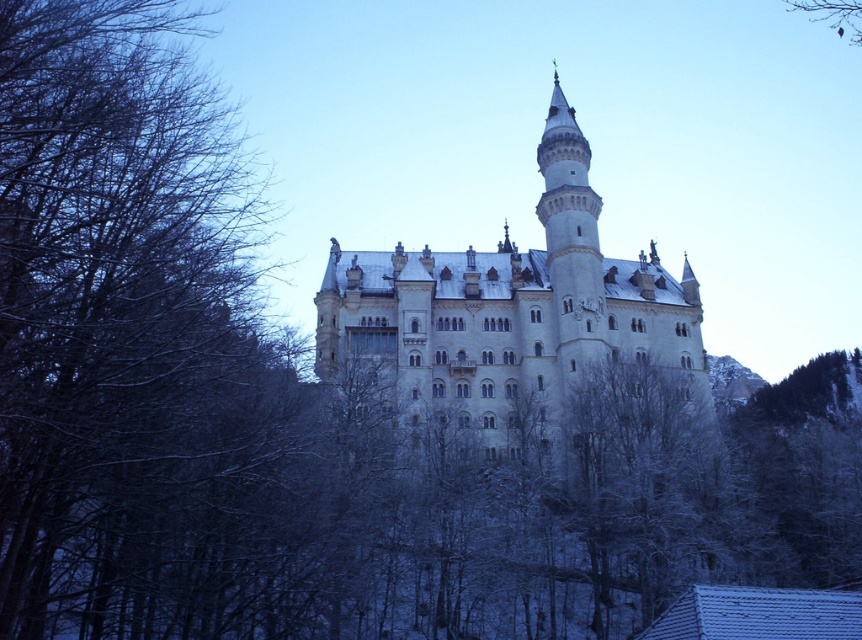
You are a bird flying over a winter landscape. You spot the white stone castle at center and the brown textured branch at upper right. How far apart are these two landmarks?

The white stone castle at center is 200.27 feet from the brown textured branch at upper right.

You are an architect examining the castle layout. From your vantage point, does the white stone castle at center appear positioned above or below the brown textured branch at upper right?

The white stone castle at center is located below the brown textured branch at upper right.

You are an artist planning to paint the scene of the white stone castle at center and the brown textured branch at upper right. Which object should you paint first if you follow the rule of painting larger objects before smaller ones?

The white stone castle at center should be painted first because it is larger in size than the brown textured branch at upper right.